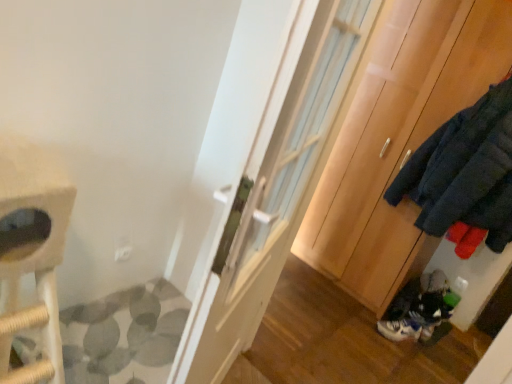
Question: Is wooden cabinet at right closer to the viewer compared to white glossy door at center?

Choices:
 (A) yes
 (B) no

Answer: (B)

Question: Does wooden cabinet at right come behind white glossy door at center?

Choices:
 (A) yes
 (B) no

Answer: (A)

Question: Can you confirm if wooden cabinet at right is wider than white glossy door at center?

Choices:
 (A) no
 (B) yes

Answer: (B)

Question: From the image's perspective, is wooden cabinet at right located beneath white glossy door at center?

Choices:
 (A) yes
 (B) no

Answer: (B)

Question: Does wooden cabinet at right have a lesser height compared to white glossy door at center?

Choices:
 (A) yes
 (B) no

Answer: (B)

Question: Based on their sizes in the image, would you say white glossy door at center is bigger or smaller than wooden cabinet at right?

Choices:
 (A) small
 (B) big

Answer: (A)

Question: Considering the positions of point (203, 327) and point (342, 172), is point (203, 327) closer or farther from the camera than point (342, 172)?

Choices:
 (A) farther
 (B) closer

Answer: (B)

Question: From the image's perspective, relative to wooden cabinet at right, is white glossy door at center above or below?

Choices:
 (A) above
 (B) below

Answer: (B)

Question: In terms of width, does white glossy door at center look wider or thinner when compared to wooden cabinet at right?

Choices:
 (A) thin
 (B) wide

Answer: (A)

Question: Considering the positions of wooden cabinet at right and white glossy door at center in the image, is wooden cabinet at right taller or shorter than white glossy door at center?

Choices:
 (A) tall
 (B) short

Answer: (A)

Question: Would you say wooden cabinet at right is to the left or to the right of white glossy door at center in the picture?

Choices:
 (A) right
 (B) left

Answer: (A)

Question: Is point (351, 190) positioned closer to the camera than point (272, 218)?

Choices:
 (A) farther
 (B) closer

Answer: (A)

Question: From the image's perspective, is wooden cabinet at right above or below white glossy door at center?

Choices:
 (A) below
 (B) above

Answer: (B)

Question: Considering the positions of wooden cabinet at right and white leather sneaker at lower right in the image, is wooden cabinet at right taller or shorter than white leather sneaker at lower right?

Choices:
 (A) tall
 (B) short

Answer: (A)

Question: Does point 431,18 appear closer or farther from the camera than point 409,327?

Choices:
 (A) closer
 (B) farther

Answer: (A)